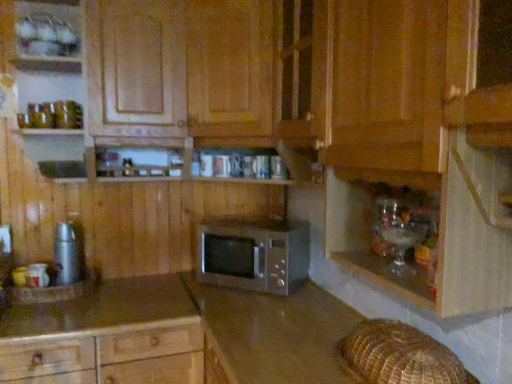
At what (x,y) coordinates should I click in order to perform the action: click on unoccupied area in front of satin silver microwave at center. Please return your answer as a coordinate pair (x, y). The image size is (512, 384). Looking at the image, I should click on (255, 312).